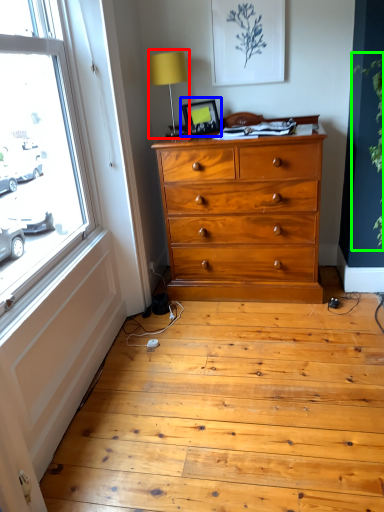
Question: Which object is positioned farthest from table lamp (highlighted by a red box)? Select from picture frame (highlighted by a blue box) and plant (highlighted by a green box).

Choices:
 (A) picture frame
 (B) plant

Answer: (B)